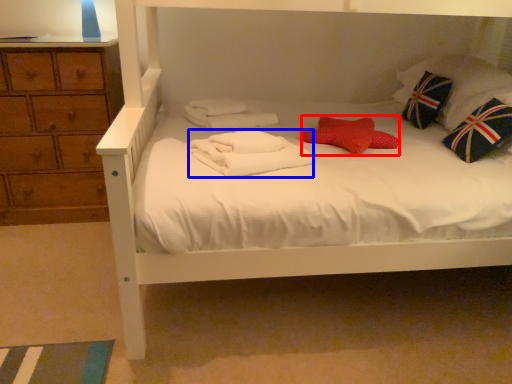
Question: Among these objects, which one is farthest to the camera, pillow (highlighted by a red box) or bath towel (highlighted by a blue box)?

Choices:
 (A) pillow
 (B) bath towel

Answer: (A)